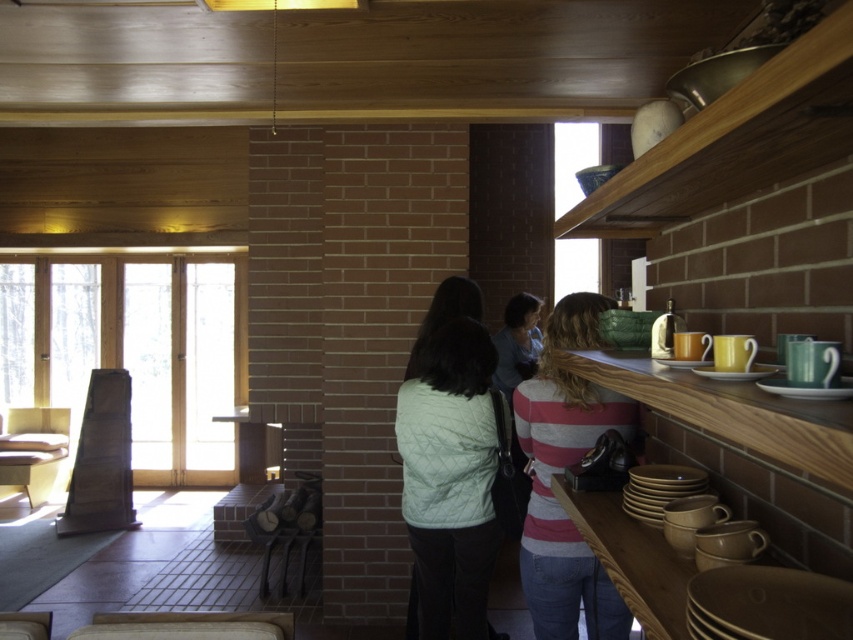
You are standing in the room and want to reach both the light green quilted vest at center and the striped cotton shirt at upper right. Which item is closer to you?

The light green quilted vest at center is closer to you because it is further to the viewer than the striped cotton shirt at upper right.

You are a tailor who needs to determine if the light green quilted vest at center can be placed on the matte brown plate at shelf center without touching the ceiling. Can you confirm if the vest will fit on the plate?

The light green quilted vest at center is much taller than the matte brown plate at shelf center, so it cannot be placed on the plate without exceeding its height.

You are a tailor trying to store two light green quilted garments in a narrow closet. The closet has a single rod that can only accommodate items within 15 inches of each other. Can you hang both the light green quilted vest at center and the light green quilted jacket at center on the rod without violating the spacing requirement?

The light green quilted vest at center is 15.83 inches away from the light green quilted jacket at center. Since the required spacing is 15 inches, the distance between them exceeds the closet rod capacity. Therefore, you cannot hang both garments on the rod without violating the spacing requirement.